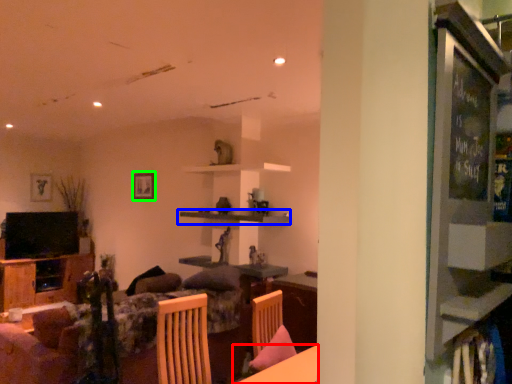
Question: Which object is positioned farthest from table (highlighted by a red box)? Select from shelf (highlighted by a blue box) and picture frame (highlighted by a green box).

Choices:
 (A) shelf
 (B) picture frame

Answer: (B)